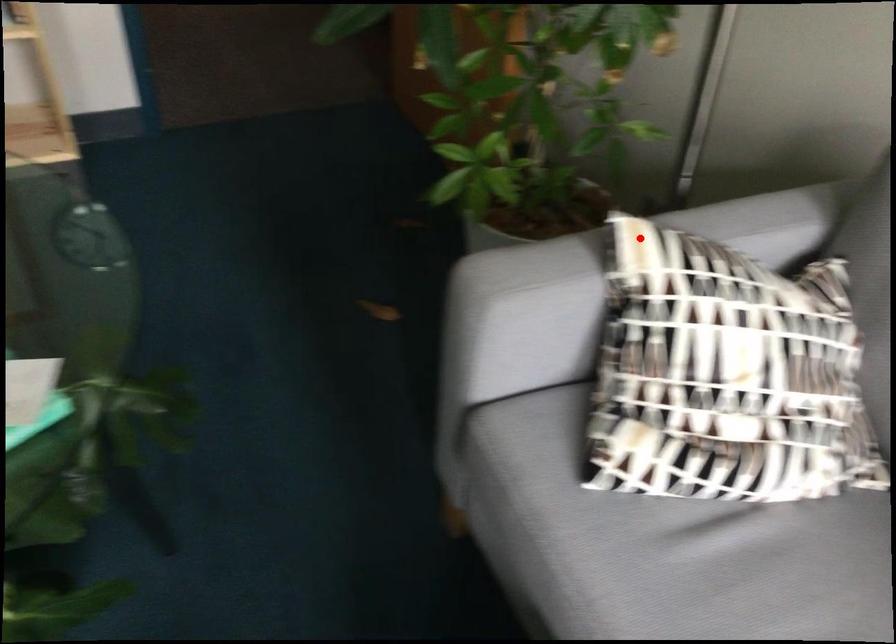
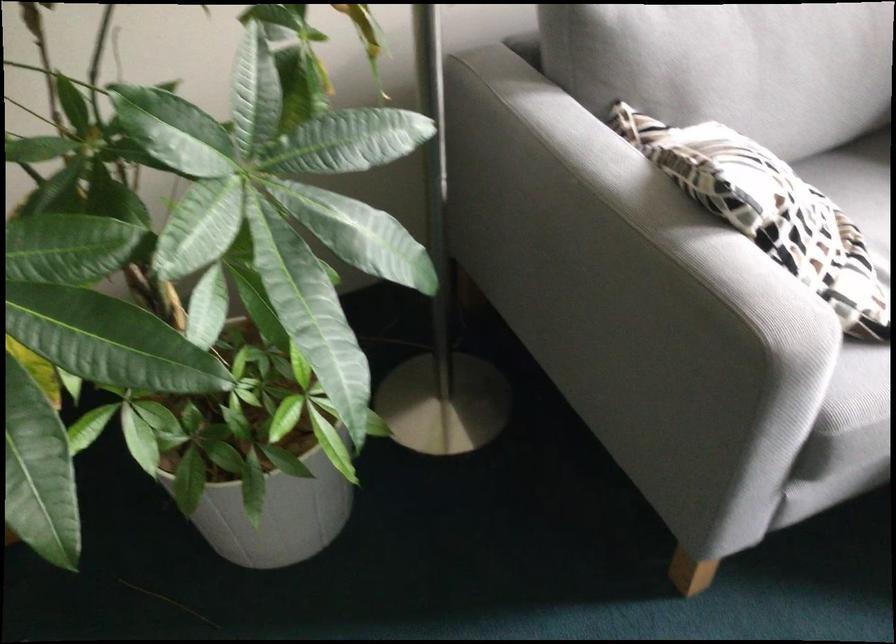
Locate, in the second image, the point that corresponds to the highlighted location in the first image.

(604, 240)